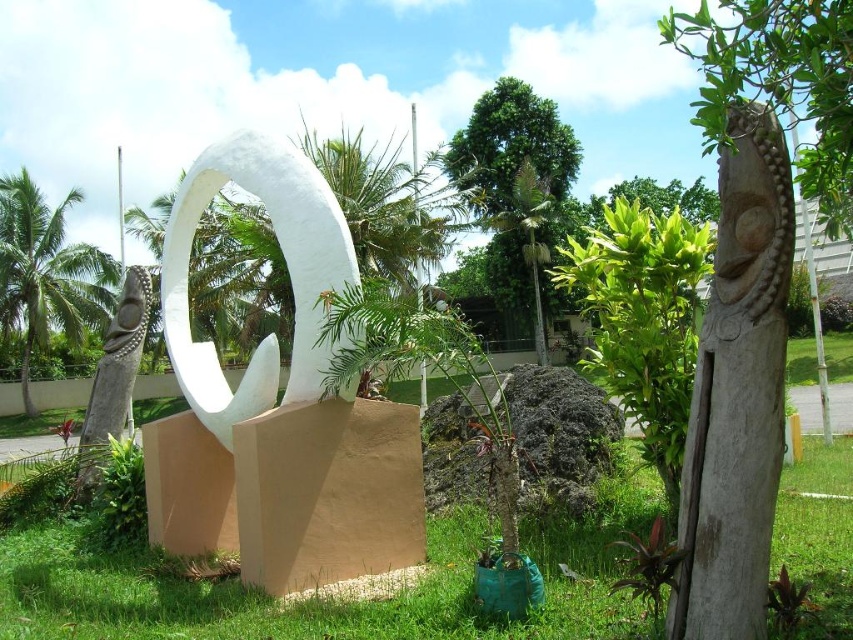
Question: Is white matte sculpture at center positioned before green leafy palm tree at center?

Choices:
 (A) no
 (B) yes

Answer: (B)

Question: Does smooth wood totem at right have a larger size compared to gray stone statue at left?

Choices:
 (A) yes
 (B) no

Answer: (B)

Question: Can you confirm if green grass at center is positioned to the right of green leafy palm tree at center?

Choices:
 (A) yes
 (B) no

Answer: (B)

Question: Which point is closer to the camera taking this photo?

Choices:
 (A) (131, 340)
 (B) (845, 68)
 (C) (76, 328)
 (D) (274, 230)

Answer: (B)

Question: Among these objects, which one is nearest to the camera?

Choices:
 (A) white matte sculpture at center
 (B) smooth wood totem at right

Answer: (B)

Question: Which of the following is the farthest from the observer?

Choices:
 (A) (235, 589)
 (B) (505, 93)
 (C) (762, 422)

Answer: (B)